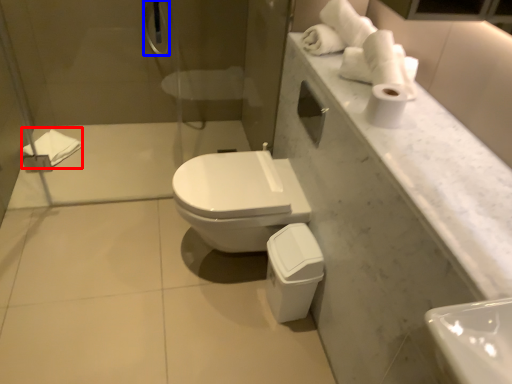
Question: Which object appears farthest to the camera in this image, bath towel (highlighted by a red box) or shower (highlighted by a blue box)?

Choices:
 (A) bath towel
 (B) shower

Answer: (A)